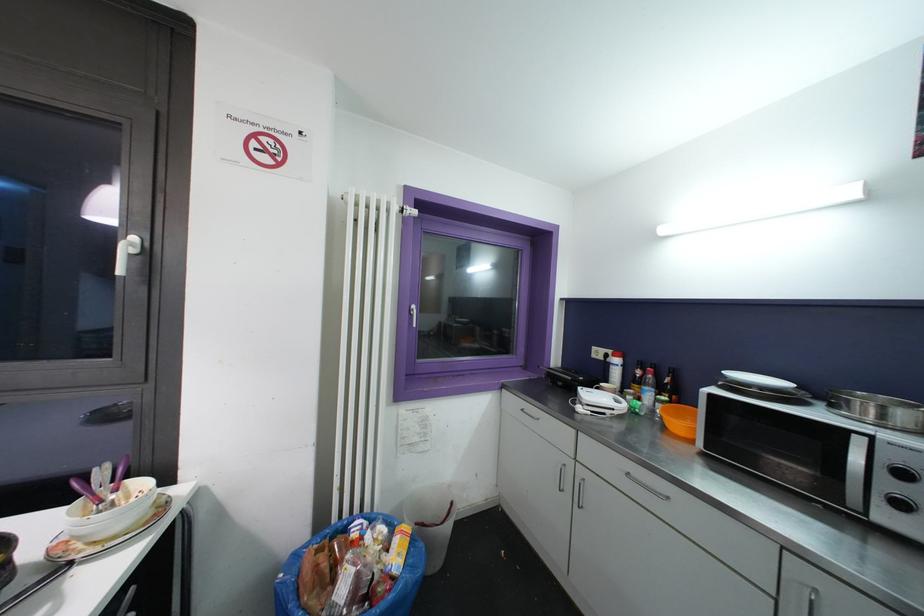
What do you see at coordinates (856, 472) in the screenshot? I see `the microwave door handle` at bounding box center [856, 472].